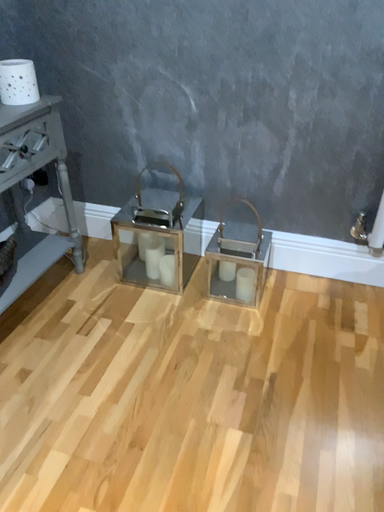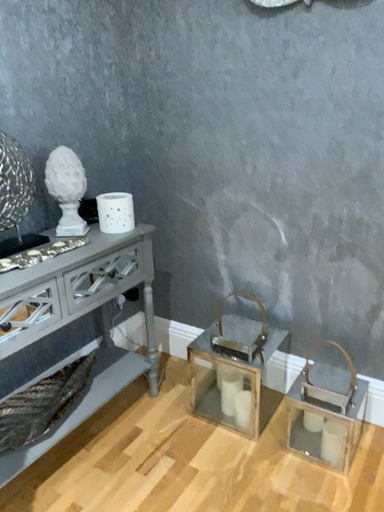
Question: How did the camera likely rotate when shooting the video?

Choices:
 (A) rotated upward
 (B) rotated downward

Answer: (A)